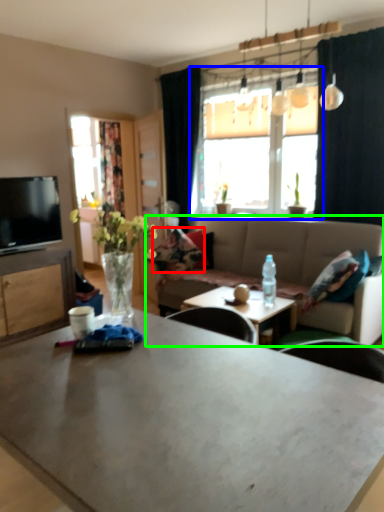
Question: Considering the real-world distances, which object is farthest from pillow (highlighted by a red box)? window (highlighted by a blue box) or studio couch (highlighted by a green box)?

Choices:
 (A) window
 (B) studio couch

Answer: (A)